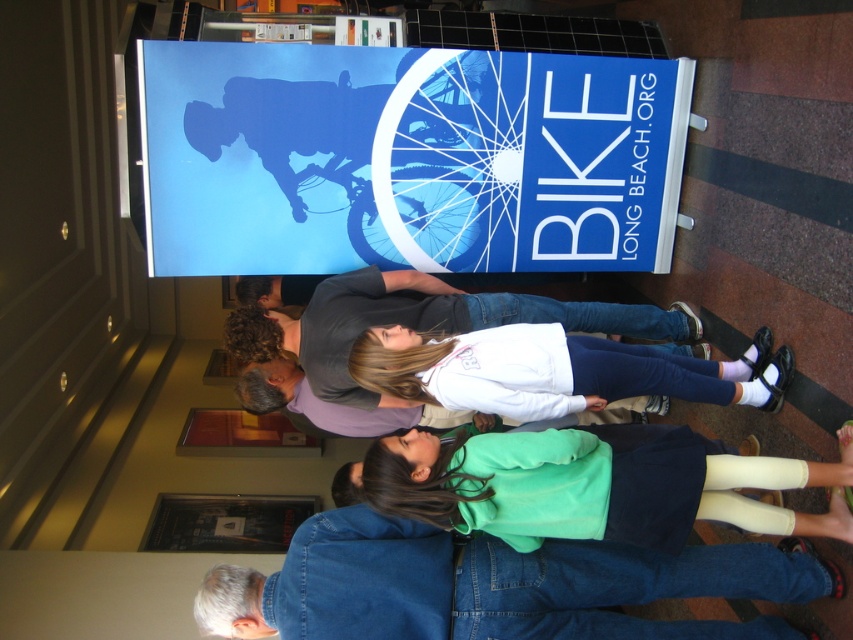
Question: Which point is closer to the camera?

Choices:
 (A) white soft fabric at center
 (B) green fleece sweatshirt at center
 (C) white matte shirt at center
 (D) denim jeans at lower center

Answer: (B)

Question: Does denim jeans at lower center appear over green fleece sweatshirt at center?

Choices:
 (A) no
 (B) yes

Answer: (A)

Question: Does green fleece sweatshirt at center come in front of white soft fabric at center?

Choices:
 (A) no
 (B) yes

Answer: (B)

Question: Which of the following is the farthest from the observer?

Choices:
 (A) (701, 396)
 (B) (640, 584)
 (C) (311, 342)
 (D) (787, 476)

Answer: (C)

Question: Which of the following is the closest to the observer?

Choices:
 (A) (589, 305)
 (B) (602, 371)
 (C) (744, 550)

Answer: (C)

Question: From the image, what is the correct spatial relationship of green fleece sweatshirt at center in relation to white soft fabric at center?

Choices:
 (A) below
 (B) above

Answer: (A)